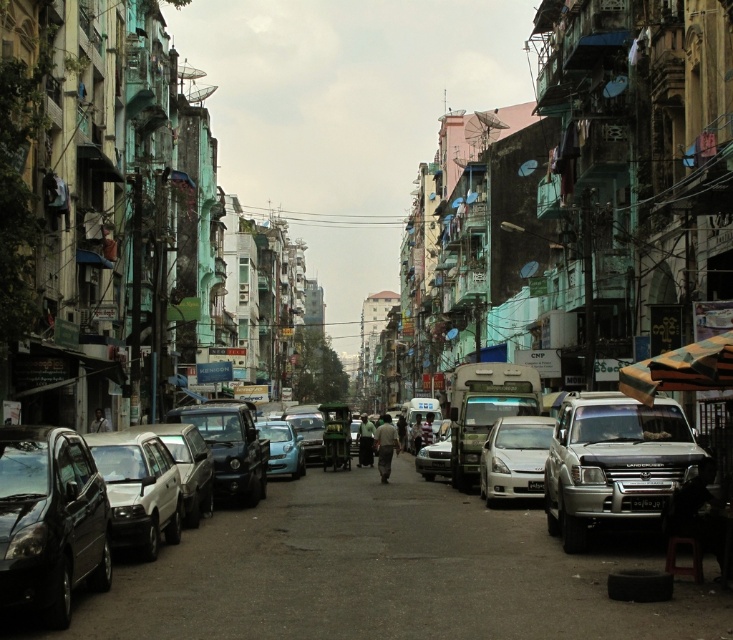
You are a delivery person standing at the edge of the street. You need to deliver a package to the dark gray fabric person at center. The light brown fabric pants at center is blocking your path. Can you walk around them? Explain your reasoning.

The light brown fabric pants at center is 34.17 feet away from the dark gray fabric person at center. Since the distance between them is significant, you can easily walk around the light brown fabric pants at center to reach the dark gray fabric person at center without any issues.

You are a delivery person trying to navigate through the narrow street. You see a silver metallic suv at right and a dark gray fabric person at center. Which object takes up more space in the scene?

The silver metallic suv at right is bigger than the dark gray fabric person at center, so it takes up more space in the scene.

You are standing on the bustling urban street depicted in the scene. There are two points marked on the ground in front of you. The first point is at coordinates point (692, 445) and the second is at point (103, 412). Which point is closer to your current position?

Point (692, 445) is closer to the viewer than point (103, 412).